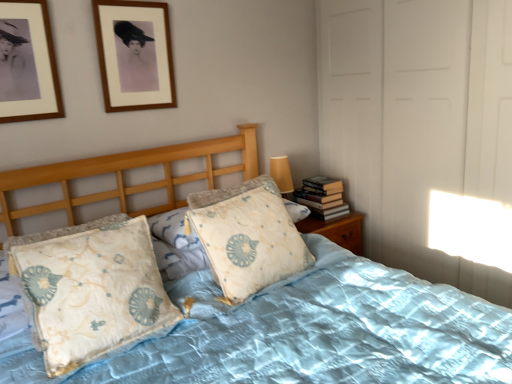
This screenshot has width=512, height=384. I want to click on wooden picture frame at upper left, acting as the first picture frame starting from the front, so click(x=27, y=63).

Locate an element on the screen. wooden picture frame at upper left, the first picture frame viewed from the right is located at coordinates (134, 55).

What is the approximate height of hardcover books at right?

It is 8.15 inches.

Image resolution: width=512 pixels, height=384 pixels. Find the location of `light blue quilted bed at center`. light blue quilted bed at center is located at coordinates (328, 334).

Can you confirm if wooden picture frame at upper left, acting as the first picture frame starting from the front, is bigger than light blue fabric pillow at center, the second pillow from the left?

Actually, wooden picture frame at upper left, acting as the first picture frame starting from the front, might be smaller than light blue fabric pillow at center, the second pillow from the left.

Considering the relative sizes of wooden picture frame at upper left, arranged as the 1th picture frame when viewed from the left, and light blue fabric pillow at center, the second pillow from the left, in the image provided, is wooden picture frame at upper left, arranged as the 1th picture frame when viewed from the left, thinner than light blue fabric pillow at center, the second pillow from the left,?

Correct, the width of wooden picture frame at upper left, arranged as the 1th picture frame when viewed from the left, is less than that of light blue fabric pillow at center, the second pillow from the left.

Are wooden picture frame at upper left, acting as the first picture frame starting from the front, and light blue fabric pillow at center, the 1th pillow from the right, located far from each other?

wooden picture frame at upper left, acting as the first picture frame starting from the front, is actually quite close to light blue fabric pillow at center, the 1th pillow from the right.

Is point (50, 101) closer to camera compared to point (244, 277)?

No, it is behind (244, 277).

Image resolution: width=512 pixels, height=384 pixels. In the image, there is a wooden picture frame at upper left, which is the second picture frame in back-to-front order. Identify the location of picture frame above it (from the image's perspective). (134, 55).

Which object is positioned more to the right, wooden picture frame at upper left, which is the second picture frame in back-to-front order, or wooden picture frame at upper left, the first picture frame viewed from the right?

From the viewer's perspective, wooden picture frame at upper left, the first picture frame viewed from the right, appears more on the right side.

Does point (19, 7) come in front of point (134, 37)?

Yes, it is in front of point (134, 37).

In the scene shown: Choose the correct answer: Is wooden picture frame at upper left, acting as the second picture frame starting from the right, inside wooden picture frame at upper left, the 2th picture frame positioned from the front, or outside it?

wooden picture frame at upper left, acting as the second picture frame starting from the right, is spatially situated outside wooden picture frame at upper left, the 2th picture frame positioned from the front.

Can you confirm if light blue quilted bed at center is wider than wooden picture frame at upper left, the 1th picture frame when ordered from back to front?

Correct, the width of light blue quilted bed at center exceeds that of wooden picture frame at upper left, the 1th picture frame when ordered from back to front.

Is light blue quilted bed at center positioned beyond the bounds of wooden picture frame at upper left, the first picture frame viewed from the right?

light blue quilted bed at center lies outside wooden picture frame at upper left, the first picture frame viewed from the right,'s area.

Based on the photo, from a real-world perspective, is light blue quilted bed at center above or below wooden picture frame at upper left, marked as the second picture frame in a left-to-right arrangement?

Clearly, from a real-world perspective, light blue quilted bed at center is below wooden picture frame at upper left, marked as the second picture frame in a left-to-right arrangement.

Considering the sizes of objects wooden picture frame at upper left, the 1th picture frame when ordered from back to front, and light blue quilted bed at center in the image provided, who is bigger, wooden picture frame at upper left, the 1th picture frame when ordered from back to front, or light blue quilted bed at center?

Bigger between the two is light blue quilted bed at center.

Considering the sizes of objects wooden picture frame at upper left, the 1th picture frame when ordered from back to front, and light blue quilted bed at center in the image provided, who is shorter, wooden picture frame at upper left, the 1th picture frame when ordered from back to front, or light blue quilted bed at center?

wooden picture frame at upper left, the 1th picture frame when ordered from back to front.

Is point (151, 58) closer or farther from the camera than point (178, 288)?

Point (151, 58).

Is wooden picture frame at upper left, the 2th picture frame positioned from the front, aimed at light blue quilted bed at center?

No, wooden picture frame at upper left, the 2th picture frame positioned from the front, does not turn towards light blue quilted bed at center.

From a real-world perspective, is light blue fabric pillow at center, the 1th pillow from the right, positioned over wooden picture frame at upper left, the first picture frame viewed from the right, based on gravity?

Actually, light blue fabric pillow at center, the 1th pillow from the right, is physically below wooden picture frame at upper left, the first picture frame viewed from the right, in the real world.

Considering the points (293, 264) and (165, 52), which point is behind, point (293, 264) or point (165, 52)?

The point (165, 52) is more distant.

Could you tell me if light blue fabric pillow at center, the second pillow from the left, is facing wooden picture frame at upper left, the 1th picture frame when ordered from back to front?

No, light blue fabric pillow at center, the second pillow from the left, does not turn towards wooden picture frame at upper left, the 1th picture frame when ordered from back to front.

Is wooden picture frame at upper left, the 1th picture frame when ordered from back to front, inside light blue fabric pillow at center, the 1th pillow from the right?

No.

Is light blue quilted bed at center placed right next to wooden picture frame at upper left, arranged as the 1th picture frame when viewed from the left?

No, light blue quilted bed at center is not next to wooden picture frame at upper left, arranged as the 1th picture frame when viewed from the left.

Considering the positions of objects light blue quilted bed at center and wooden picture frame at upper left, which is the second picture frame in back-to-front order, in the image provided, who is more to the left, light blue quilted bed at center or wooden picture frame at upper left, which is the second picture frame in back-to-front order,?

wooden picture frame at upper left, which is the second picture frame in back-to-front order, is more to the left.

Could you tell me if light blue quilted bed at center is turned towards wooden picture frame at upper left, acting as the second picture frame starting from the right?

No, light blue quilted bed at center does not turn towards wooden picture frame at upper left, acting as the second picture frame starting from the right.

How many degrees apart are the facing directions of light blue fabric pillow at center, which is the 1th pillow in left-to-right order, and light blue fabric pillow at center, the 1th pillow from the right?

The facing directions of light blue fabric pillow at center, which is the 1th pillow in left-to-right order, and light blue fabric pillow at center, the 1th pillow from the right, are 7.04 degrees apart.

Is light blue fabric pillow at center, which is the 1th pillow in left-to-right order, directly adjacent to light blue fabric pillow at center, the 1th pillow from the right?

No, light blue fabric pillow at center, which is the 1th pillow in left-to-right order, is not beside light blue fabric pillow at center, the 1th pillow from the right.

Considering the relative sizes of light blue fabric pillow at center, which is the 2th pillow from right to left, and light blue fabric pillow at center, the second pillow from the left, in the image provided, is light blue fabric pillow at center, which is the 2th pillow from right to left, taller than light blue fabric pillow at center, the second pillow from the left,?

No.

Which object is thinner, light blue fabric pillow at center, which is the 2th pillow from right to left, or light blue fabric pillow at center, the 1th pillow from the right?

With smaller width is light blue fabric pillow at center, the 1th pillow from the right.

The width and height of the screenshot is (512, 384). In order to click on the 1st picture frame above the light blue fabric pillow at center, the second pillow from the left (from the image's perspective) in this screenshot , I will do `click(27, 63)`.

This screenshot has height=384, width=512. I want to click on picture frame above the wooden picture frame at upper left, the 1th picture frame when ordered from back to front (from a real-world perspective), so click(27, 63).

Which object lies further to the anchor point light blue quilted bed at center, light blue fabric pillow at center, the second pillow from the left, or wooden picture frame at upper left, the 2th picture frame positioned from the front?

wooden picture frame at upper left, the 2th picture frame positioned from the front, lies further to light blue quilted bed at center than the other object.

Considering their positions, is wooden picture frame at upper left, the 2th picture frame positioned from the front, positioned further to hardcover books at right than light blue fabric pillow at center, the second pillow from the left?

wooden picture frame at upper left, the 2th picture frame positioned from the front, is positioned further to the anchor hardcover books at right.

Based on their spatial positions, is wooden picture frame at upper left, acting as the first picture frame starting from the front, or hardcover books at right further from light blue fabric pillow at center, the second pillow from the left?

The object further to light blue fabric pillow at center, the second pillow from the left, is wooden picture frame at upper left, acting as the first picture frame starting from the front.

From the image, which object appears to be farther from light blue fabric pillow at center, the second pillow from the left, light blue quilted bed at center or hardcover books at right?

hardcover books at right.

When comparing their distances from hardcover books at right, does light blue quilted bed at center or light blue fabric pillow at center, which is the 1th pillow in left-to-right order, seem further?

→ light blue fabric pillow at center, which is the 1th pillow in left-to-right order, is further to hardcover books at right.

Considering their positions, is wooden picture frame at upper left, arranged as the 1th picture frame when viewed from the left, positioned further to wooden picture frame at upper left, the 2th picture frame positioned from the front, than light blue fabric pillow at center, which is the 1th pillow in left-to-right order?

The object further to wooden picture frame at upper left, the 2th picture frame positioned from the front, is light blue fabric pillow at center, which is the 1th pillow in left-to-right order.

Looking at this image, when comparing their distances from light blue quilted bed at center, does hardcover books at right or wooden picture frame at upper left, the 1th picture frame when ordered from back to front, seem further?

wooden picture frame at upper left, the 1th picture frame when ordered from back to front.

Which object lies further to the anchor point wooden picture frame at upper left, the 1th picture frame when ordered from back to front, light blue fabric pillow at center, which is the 2th pillow from right to left, or hardcover books at right?

Based on the image, hardcover books at right appears to be further to wooden picture frame at upper left, the 1th picture frame when ordered from back to front.

The width and height of the screenshot is (512, 384). I want to click on pillow located between light blue quilted bed at center and light blue fabric pillow at center, the second pillow from the left, in the depth direction, so click(90, 289).

Identify the location of picture frame between wooden picture frame at upper left, arranged as the 1th picture frame when viewed from the left, and hardcover books at right. This screenshot has height=384, width=512. (134, 55).

At what (x,y) coordinates should I click in order to perform the action: click on pillow that lies between wooden picture frame at upper left, the 2th picture frame positioned from the front, and light blue fabric pillow at center, which is the 1th pillow in left-to-right order, from top to bottom. Please return your answer as a coordinate pair (x, y). Image resolution: width=512 pixels, height=384 pixels. Looking at the image, I should click on (247, 236).

Where is `picture frame between light blue quilted bed at center and wooden picture frame at upper left, marked as the second picture frame in a left-to-right arrangement, from front to back`? picture frame between light blue quilted bed at center and wooden picture frame at upper left, marked as the second picture frame in a left-to-right arrangement, from front to back is located at coordinates point(27,63).